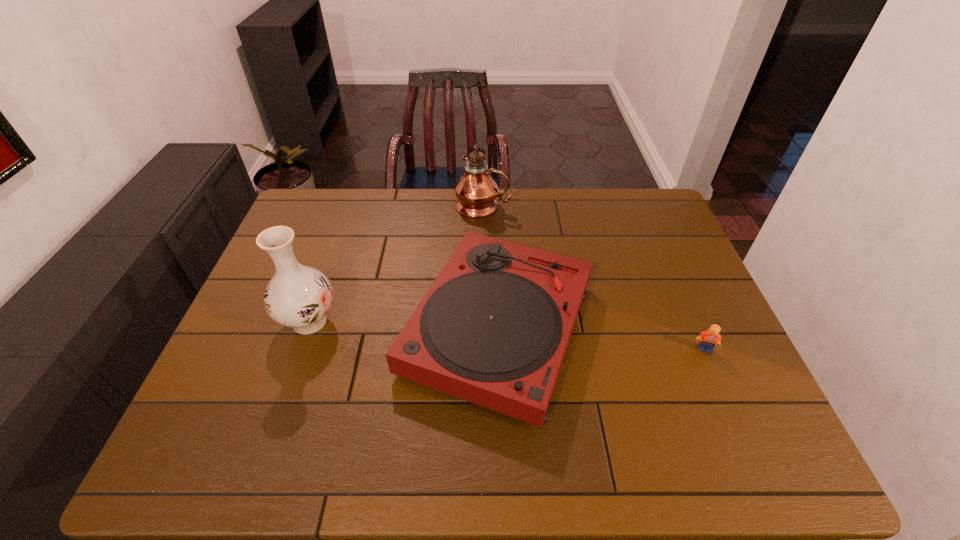
This screenshot has width=960, height=540. I want to click on the tallest object, so click(476, 191).

I want to click on the farthest object, so click(476, 191).

This screenshot has height=540, width=960. Identify the location of the second tallest object. (298, 296).

You are a GUI agent. You are given a task and a screenshot of the screen. Output one action in this format:
    pyautogui.click(x=<x>, y=<y>)
    Task: Click on the vase
    This screenshot has height=540, width=960.
    Given the screenshot: What is the action you would take?
    (x=298, y=296)

The image size is (960, 540). Identify the location of the second shortest object. (493, 328).

Find the location of `the shortest object`. the shortest object is located at coordinates (711, 337).

Where is `the rightmost object`? The height and width of the screenshot is (540, 960). the rightmost object is located at coordinates (711, 337).

Identify the location of vacant space located on the right of the farthest object. The image size is (960, 540). (524, 206).

Where is `free space located 0.370m on the right of the vase`? The image size is (960, 540). free space located 0.370m on the right of the vase is located at coordinates (479, 321).

Where is `free space located 0.230m on the right of the record player`? free space located 0.230m on the right of the record player is located at coordinates (684, 328).